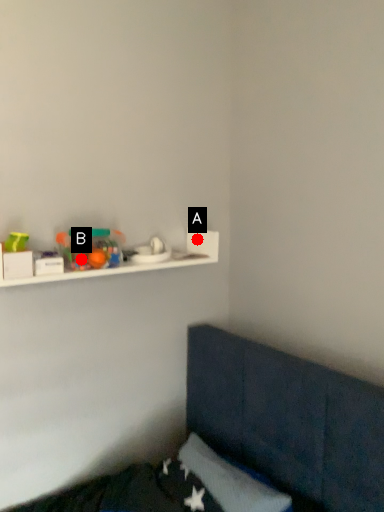
Question: Two points are circled on the image, labeled by A and B beside each circle. Which point is farther from the camera taking this photo?

Choices:
 (A) A is further
 (B) B is further

Answer: (A)